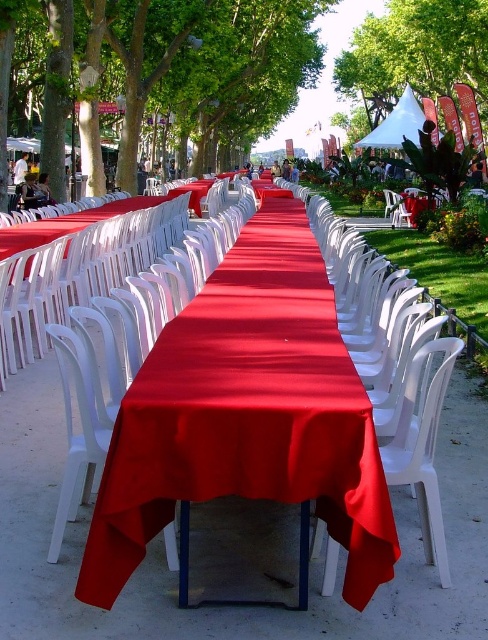
Who is positioned more to the right, red matte tablecloth at center or white plastic chair at center?

white plastic chair at center is more to the right.

Where is `red matte tablecloth at center`? This screenshot has height=640, width=488. red matte tablecloth at center is located at coordinates (246, 413).

Is green leafy tree at center closer to camera compared to white plastic chair at center?

No, it is behind white plastic chair at center.

Who is shorter, green leafy tree at center or white plastic chair at center?

With less height is white plastic chair at center.

You are a GUI agent. You are given a task and a screenshot of the screen. Output one action in this format:
    pyautogui.click(x=<x>, y=<y>)
    Task: Click on the green leafy tree at center
    The height and width of the screenshot is (640, 488).
    Given the screenshot: What is the action you would take?
    pyautogui.click(x=219, y=67)

At what (x,y) coordinates should I click in order to perform the action: click on green leafy tree at center. Please return your answer as a coordinate pair (x, y). This screenshot has height=640, width=488. Looking at the image, I should click on (219, 67).

Is green leafy tree at upper center closer to camera compared to white canvas canopy at upper center?

No.

Can you confirm if green leafy tree at upper center is wider than white canvas canopy at upper center?

Yes, green leafy tree at upper center is wider than white canvas canopy at upper center.

I want to click on green leafy tree at upper center, so 415,52.